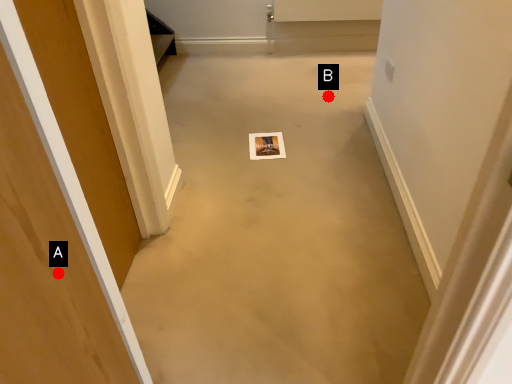
Question: Two points are circled on the image, labeled by A and B beside each circle. Which of the following is the closest to the observer?

Choices:
 (A) A is closer
 (B) B is closer

Answer: (A)